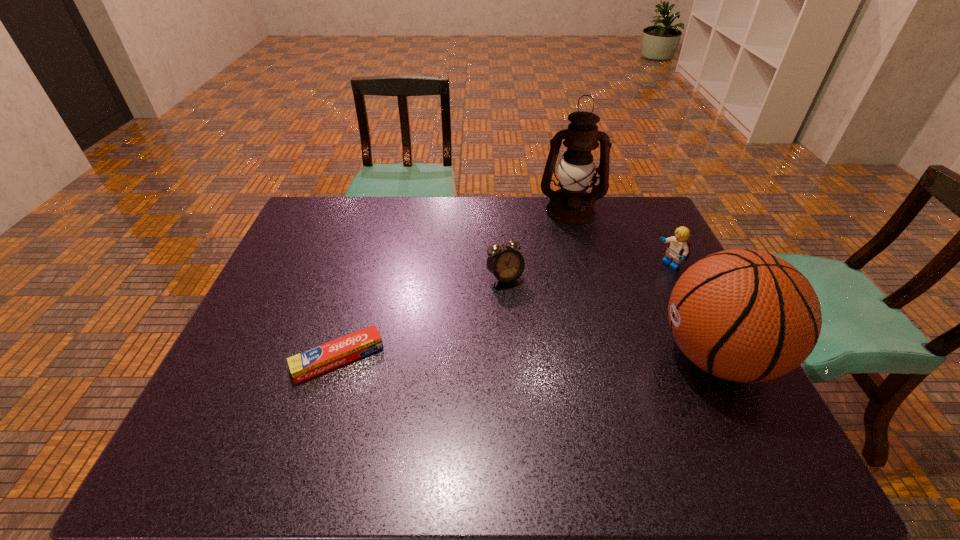
You are a GUI agent. You are given a task and a screenshot of the screen. Output one action in this format:
    pyautogui.click(x=<x>, y=<y>)
    Task: Click on the vacant space on the desktop that is between the shortest object and the basketball and is positioned on the face of the alarm clock
    Image resolution: width=960 pixels, height=540 pixels.
    Given the screenshot: What is the action you would take?
    pyautogui.click(x=555, y=357)

This screenshot has height=540, width=960. What are the coordinates of `vacant space on the desktop that is between the leftmost object and the basketball and is positioned on the side of the third object from right to left, there is a wick adjustment knob` in the screenshot? It's located at (577, 357).

Identify the location of vacant spot on the desktop that is between the shortest object and the basketball and is positioned on the front-facing side of the Lego. The height and width of the screenshot is (540, 960). (488, 357).